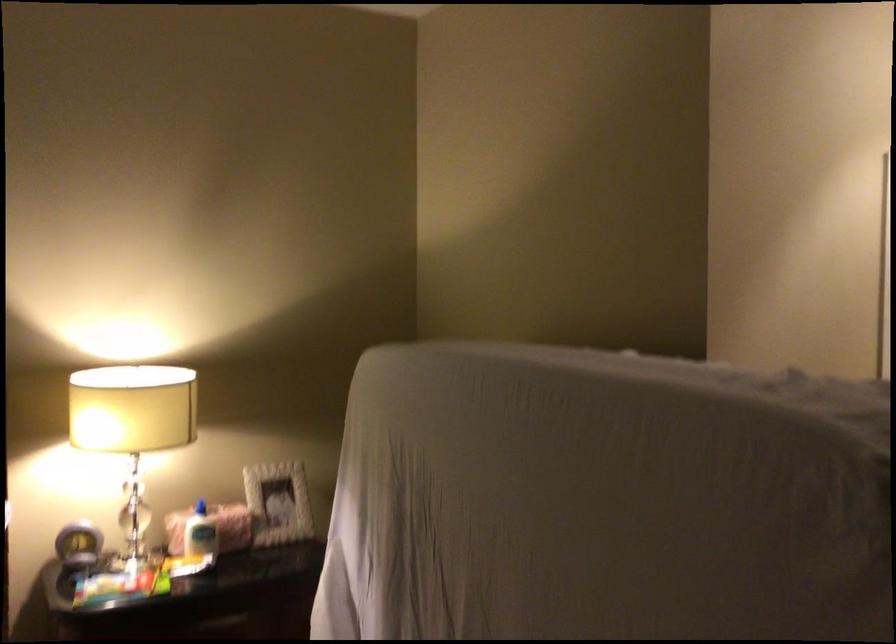
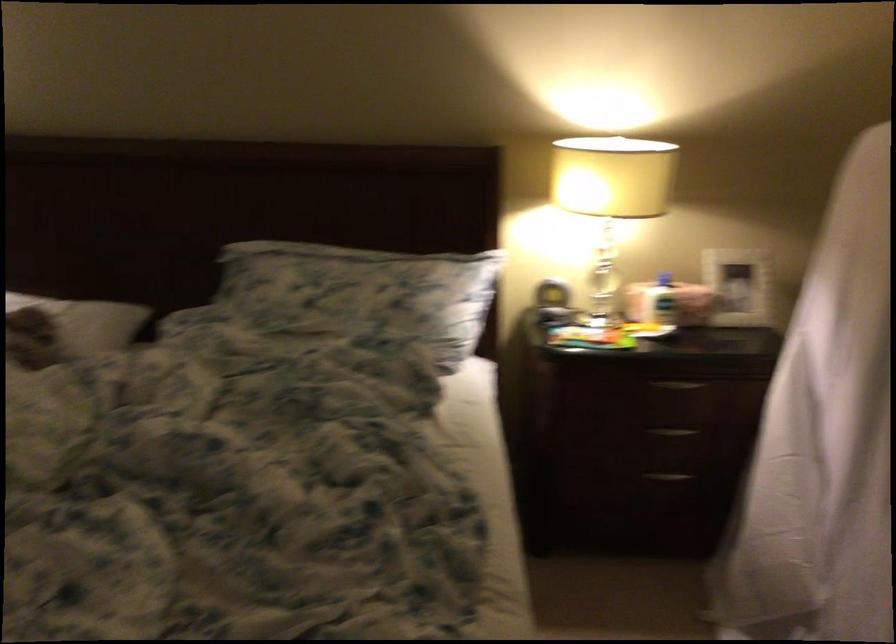
Locate, in the second image, the point that corresponds to point (271, 506) in the first image.

(737, 286)